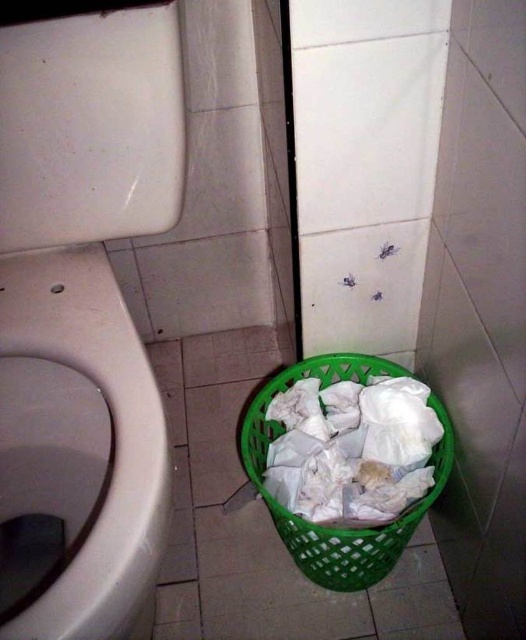
Can you confirm if white glossy toilet bowl at left is shorter than green plastic basket at lower center?

No.

Which of these two, white glossy toilet bowl at left or green plastic basket at lower center, stands shorter?

green plastic basket at lower center

Locate an element on the screen. Image resolution: width=526 pixels, height=640 pixels. white glossy toilet bowl at left is located at coordinates (80, 440).